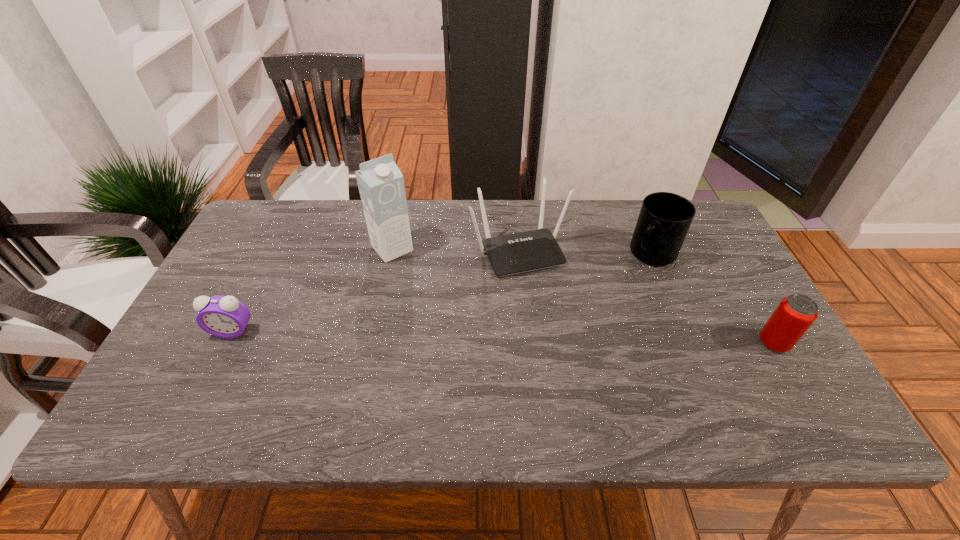
What are the coordinates of `mug that is at the far edge` in the screenshot? It's located at (664, 220).

This screenshot has height=540, width=960. I want to click on object present at the left edge, so click(222, 316).

Identify the location of can present at the right edge. The image size is (960, 540). (794, 315).

At what (x,y) coordinates should I click in order to perform the action: click on mug at the right edge. Please return your answer as a coordinate pair (x, y). The width and height of the screenshot is (960, 540). Looking at the image, I should click on (664, 220).

Image resolution: width=960 pixels, height=540 pixels. In order to click on object at the far right corner in this screenshot , I will do `click(664, 220)`.

The image size is (960, 540). I want to click on blank area at the far edge, so click(561, 207).

Image resolution: width=960 pixels, height=540 pixels. In the image, there is a desktop. In order to click on vacant space at the near edge in this screenshot , I will do `click(473, 368)`.

Find the location of a particular element. blank space at the left edge is located at coordinates (211, 292).

Image resolution: width=960 pixels, height=540 pixels. Find the location of `vacant space at the right edge`. vacant space at the right edge is located at coordinates (715, 255).

Where is `blank space at the far left corner`? This screenshot has height=540, width=960. blank space at the far left corner is located at coordinates (240, 245).